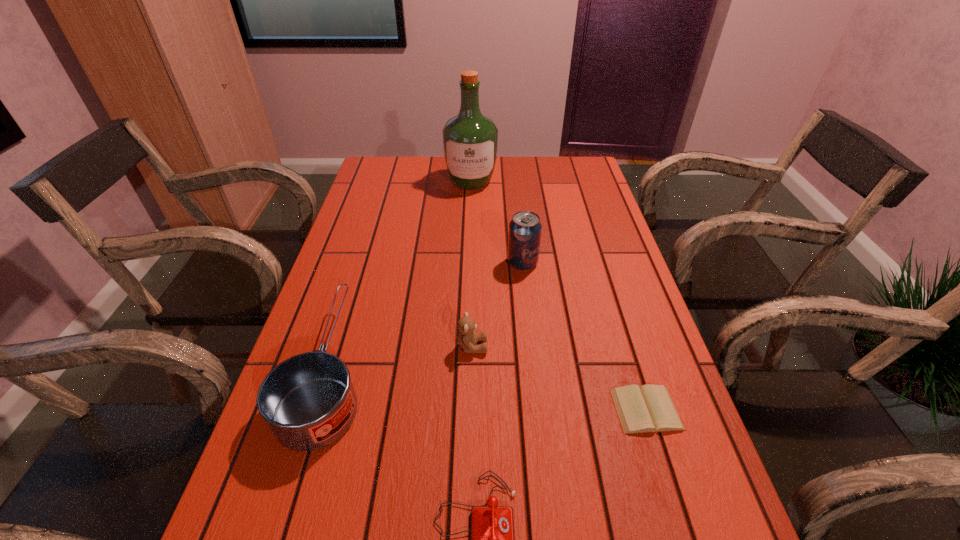
This screenshot has width=960, height=540. I want to click on vacant space at the right edge of the desktop, so click(564, 200).

The image size is (960, 540). Identify the location of free spot between the farthest object and the second tallest object. (496, 222).

At what (x,y) coordinates should I click in order to perform the action: click on vacant region between the pop soda and the farthest object. Please return your answer as a coordinate pair (x, y). The width and height of the screenshot is (960, 540). Looking at the image, I should click on (496, 222).

I want to click on vacant space that is in between the rightmost object and the tallest object, so click(x=559, y=296).

I want to click on free space between the farthest object and the teddy bear, so coord(471,264).

Point out which object is positioned as the second nearest to the telephone. Please provide its 2D coordinates. Your answer should be formatted as a tuple, i.e. [(x, y)], where the tuple contains the x and y coordinates of a point satisfying the conditions above.

[(649, 408)]

Identify which object is the third closest to the teddy bear. Please provide its 2D coordinates. Your answer should be formatted as a tuple, i.e. [(x, y)], where the tuple contains the x and y coordinates of a point satisfying the conditions above.

[(492, 528)]